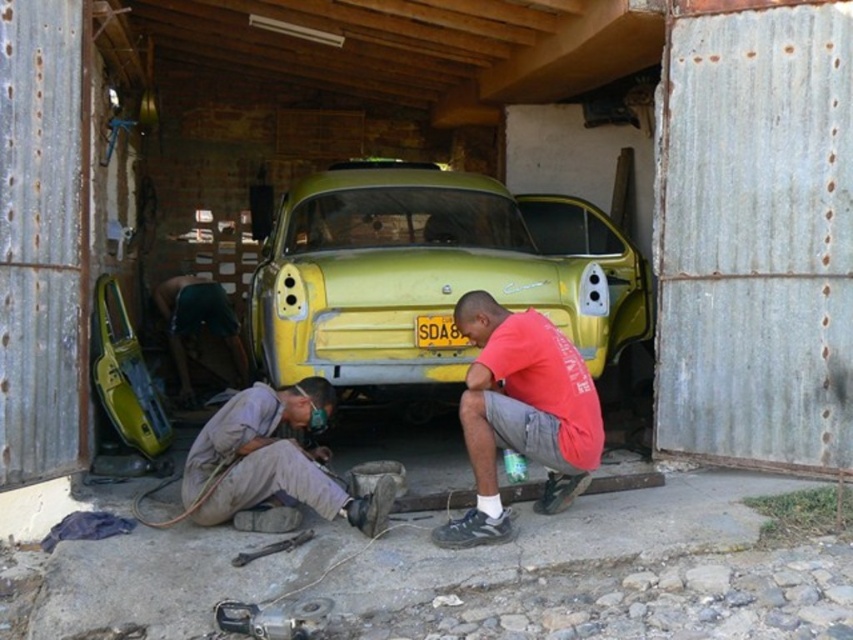
Is point (534, 301) more distant than point (383, 509)?

Yes, point (534, 301) is farther from viewer.

Does yellow matte car at center have a lesser width compared to brown leather pants at lower left?

In fact, yellow matte car at center might be wider than brown leather pants at lower left.

Between point (434, 284) and point (202, 483), which one is positioned in front?

Positioned in front is point (202, 483).

I want to click on yellow matte car at center, so [426, 273].

Does brown leather pants at lower left have a greater width compared to green matte car door at center?

Yes, brown leather pants at lower left is wider than green matte car door at center.

Which of these two, brown leather pants at lower left or green matte car door at center, stands shorter?

brown leather pants at lower left

This screenshot has height=640, width=853. Describe the element at coordinates (273, 460) in the screenshot. I see `brown leather pants at lower left` at that location.

Locate an element on the screen. This screenshot has width=853, height=640. brown leather pants at lower left is located at coordinates (273, 460).

Consider the image. Who is more distant from viewer, (x=379, y=240) or (x=514, y=429)?

The point (x=379, y=240) is behind.

Can you confirm if yellow matte car at center is thinner than red cotton shirt at center?

No.

The image size is (853, 640). I want to click on yellow matte car at center, so click(x=426, y=273).

Where is `yellow matte car at center`? The height and width of the screenshot is (640, 853). yellow matte car at center is located at coordinates (426, 273).